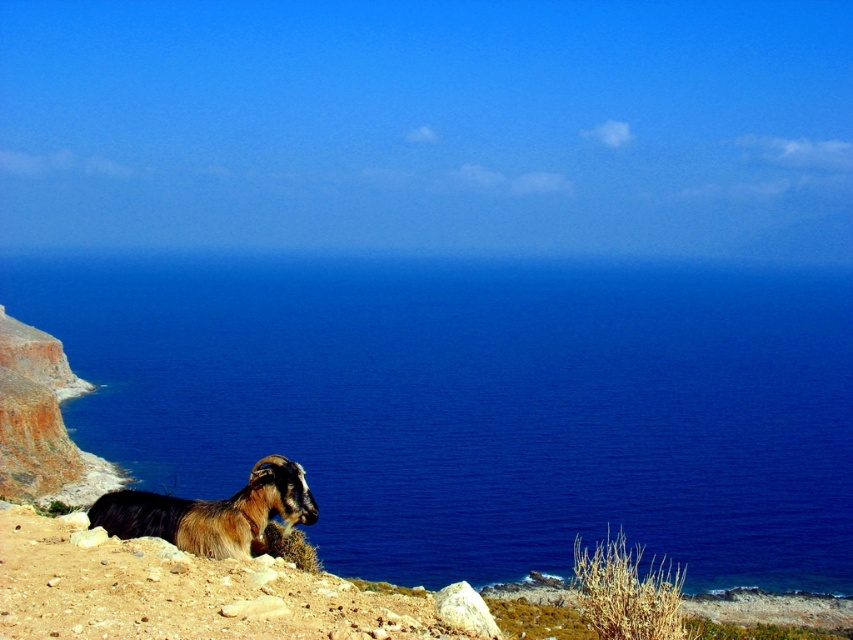
Does point (293, 387) come in front of point (109, 499)?

No, (293, 387) is further to viewer.

Which is below, blue water at lower left or brown woolen ram at lower left?

Positioned lower is brown woolen ram at lower left.

Between point (321, 275) and point (195, 516), which one is positioned behind?

Positioned behind is point (321, 275).

Identify the location of blue water at lower left. point(479,404).